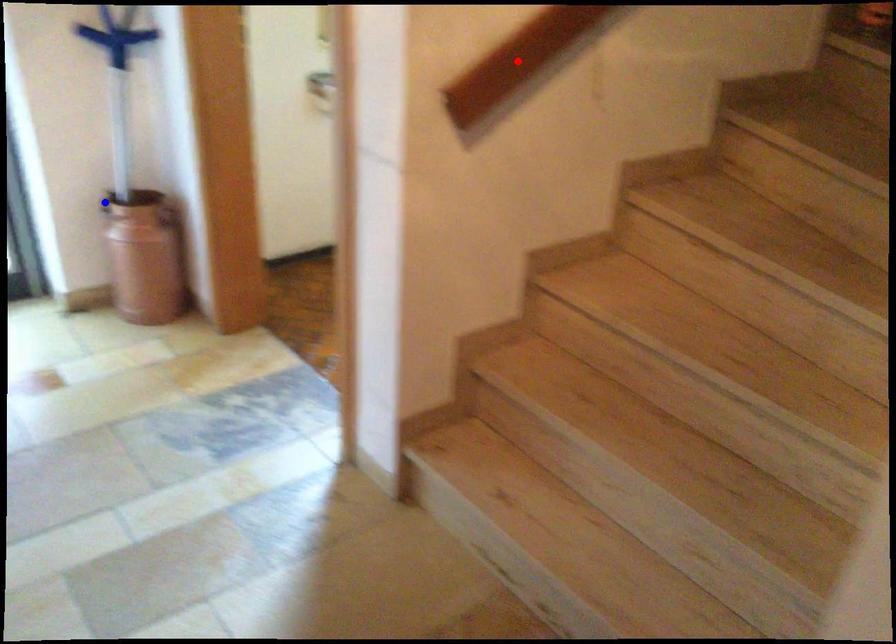
Question: Which of the two points in the image is closer to the camera?

Choices:
 (A) Blue point is closer.
 (B) Red point is closer.

Answer: (B)